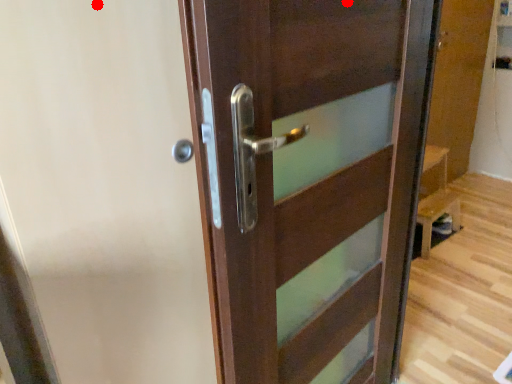
Question: Two points are circled on the image, labeled by A and B beside each circle. Which point is closer to the camera taking this photo?

Choices:
 (A) A is closer
 (B) B is closer

Answer: (B)